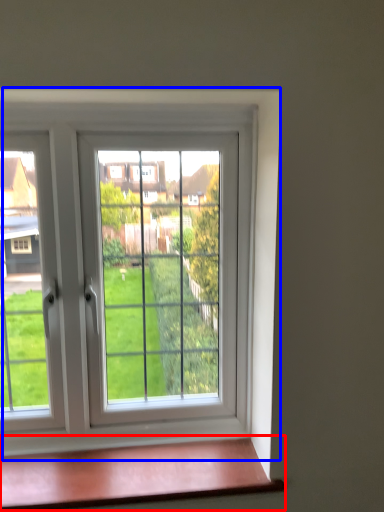
Question: Which of the following is the farthest to the observer, window sill (highlighted by a red box) or window (highlighted by a blue box)?

Choices:
 (A) window sill
 (B) window

Answer: (B)